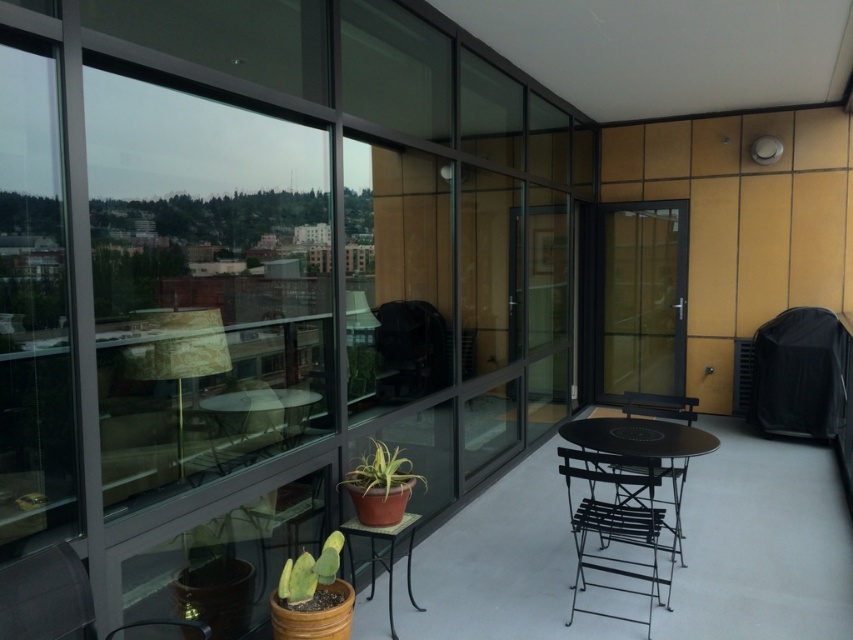
You are a delivery person trying to place a large package on the floor between the black metal chair at center and the matte black table at center. The package is 4 feet long. Will it fit in the space between them?

The space between the black metal chair at center and the matte black table at center is 3.91 feet, which is slightly shorter than the 4 feet long package. The package will not fit in the space between them.

You are a guest at this balcony and want to place a small tray on the matte black table at center. However, there is a matte terracotta pot at center above it. Is the tray likely to get water from the pot when it rains?

The matte black table at center is positioned under the matte terracotta pot at center. Since the pot is above the table, rainwater could potentially drip down onto the tray placed on the table.

You are a gardener wanting to water the green matte cactus at lower left. You are standing at the edge of the balcony near the black metal chair at center. Can you reach the cactus without moving the chair?

The black metal chair at center is positioned under the green matte cactus at lower left, so the chair is blocking direct access to the cactus. You would need to move the chair to reach it.